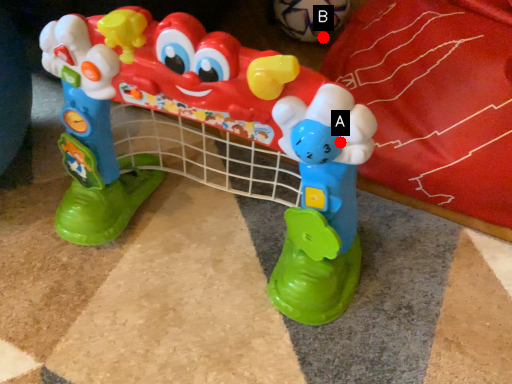
Question: Two points are circled on the image, labeled by A and B beside each circle. Which point is further to the camera?

Choices:
 (A) A is further
 (B) B is further

Answer: (B)